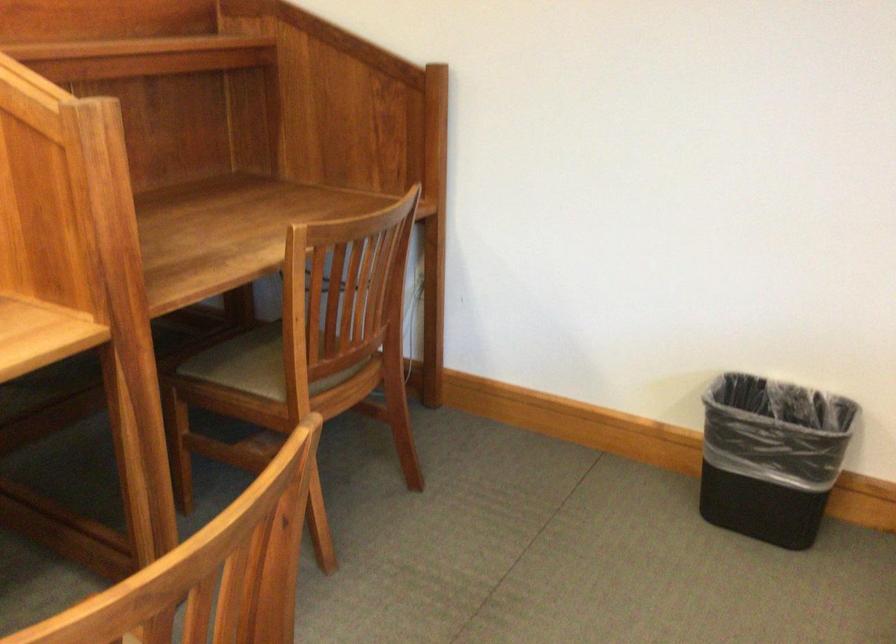
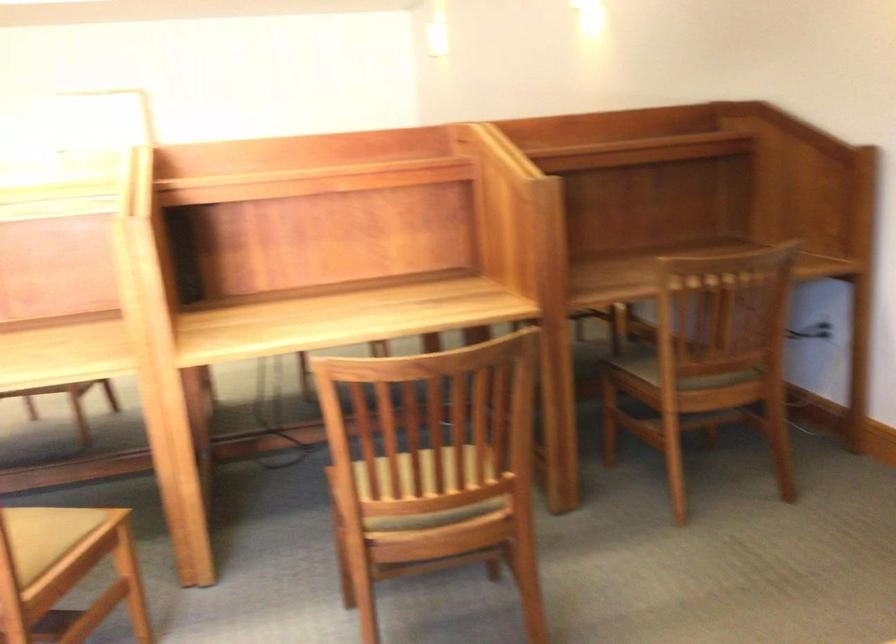
Find the pixel in the second image that matches [330,365] in the first image.

(698, 361)